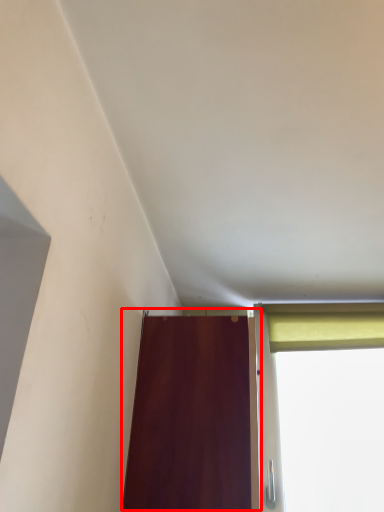
Question: In this image, where is door (annotated by the red box) located relative to curtain?

Choices:
 (A) left
 (B) right

Answer: (A)